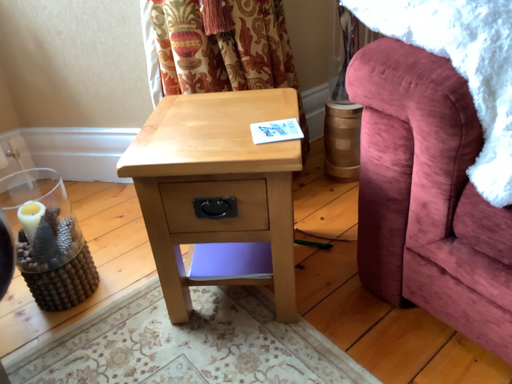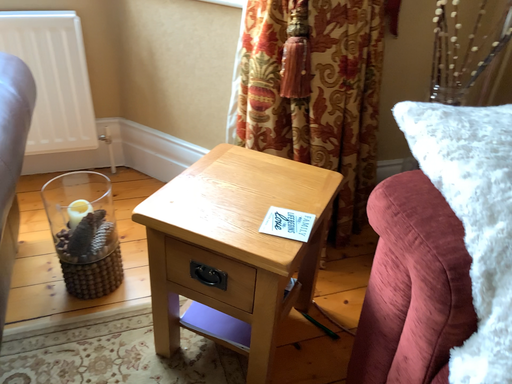
Question: Which way did the camera rotate in the video?

Choices:
 (A) rotated right
 (B) rotated left

Answer: (B)